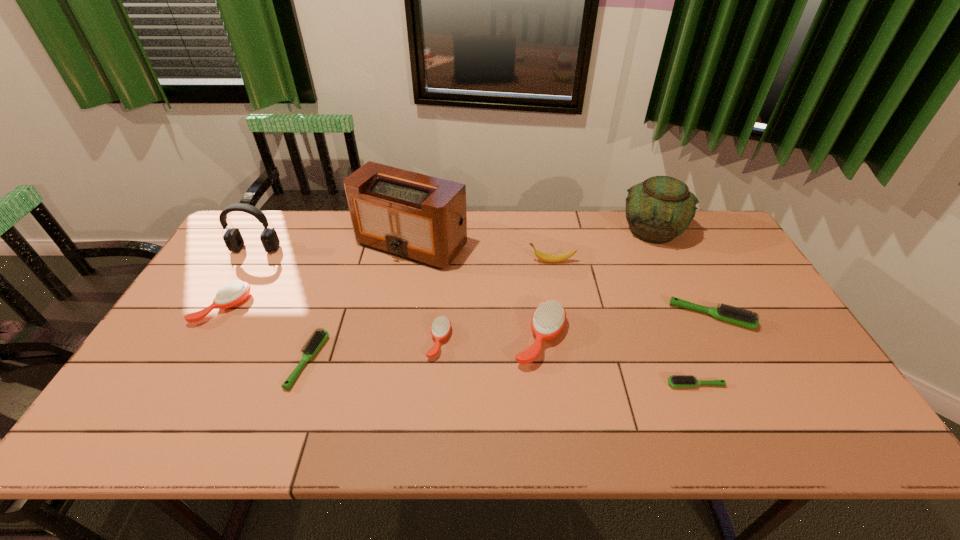
Where is `radio receiver`? The image size is (960, 540). radio receiver is located at coordinates (420, 218).

Where is `pottery`? This screenshot has height=540, width=960. pottery is located at coordinates (659, 209).

The width and height of the screenshot is (960, 540). I want to click on headset, so click(x=233, y=239).

Identify the location of banana. (553, 258).

You are a GUI agent. You are given a task and a screenshot of the screen. Output one action in this format:
    pyautogui.click(x=<x>, y=<y>)
    Task: Click on the rightmost orange hairbrush
    This screenshot has height=540, width=960.
    Given the screenshot: What is the action you would take?
    pyautogui.click(x=548, y=319)

Find the location of a particular element. The height and width of the screenshot is (540, 960). the biggest orange hairbrush is located at coordinates (548, 319).

Find the location of a particular element. The image size is (960, 540). the fifth shortest object is located at coordinates (233, 293).

Locate an element on the screen. the leftmost orange hairbrush is located at coordinates (233, 293).

The width and height of the screenshot is (960, 540). What are the coordinates of `the biggest light hairbrush` in the screenshot? It's located at [742, 317].

Image resolution: width=960 pixels, height=540 pixels. I want to click on the third hairbrush from left to right, so click(441, 326).